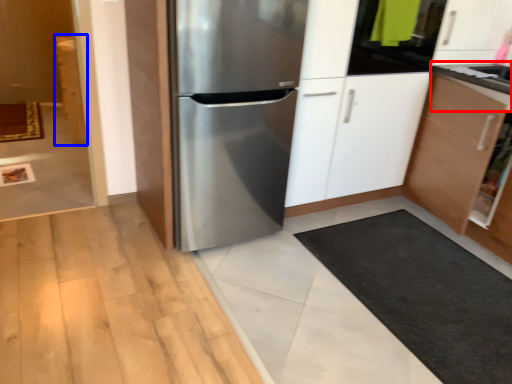
Question: Which of the following is the farthest to the observer, counter top (highlighted by a red box) or cabinetry (highlighted by a blue box)?

Choices:
 (A) counter top
 (B) cabinetry

Answer: (B)